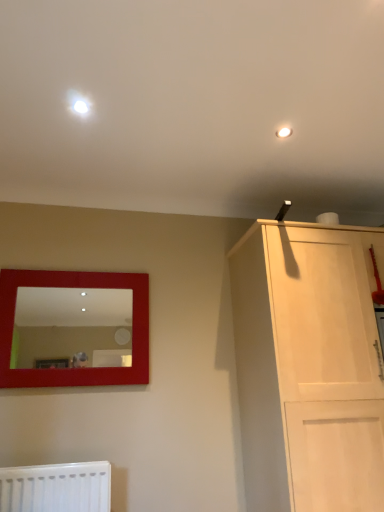
The image size is (384, 512). I want to click on matte red mirror at upper left, so click(73, 326).

Describe the element at coordinates (73, 326) in the screenshot. I see `matte red mirror at upper left` at that location.

This screenshot has width=384, height=512. In order to click on matte red mirror at upper left in this screenshot , I will do `click(73, 326)`.